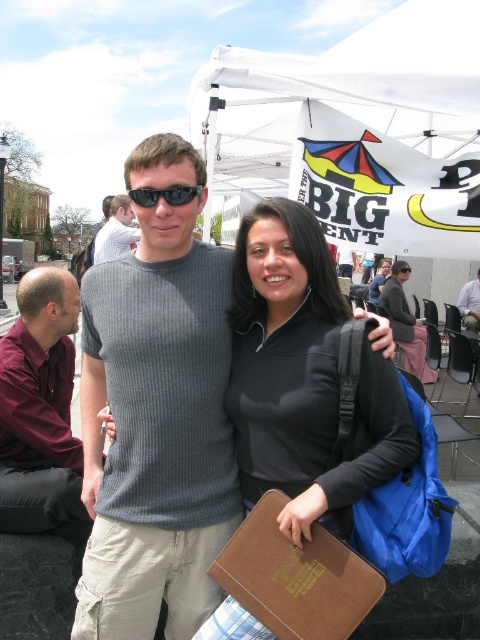
Question: Which of the following is the farthest from the observer?

Choices:
 (A) black matte sunglasses at center
 (B) gray ribbed t-shirt at center
 (C) light blue shirt at center

Answer: (C)

Question: Estimate the real-world distances between objects in this image. Which object is farther from the black matte jacket at center?

Choices:
 (A) light blue shirt at center
 (B) black matte sunglasses at center
 (C) maroon shirt at left
 (D) gray ribbed t-shirt at center

Answer: (A)

Question: Can you confirm if gray ribbed t-shirt at center is positioned to the left of light blue shirt at center?

Choices:
 (A) no
 (B) yes

Answer: (B)

Question: Estimate the real-world distances between objects in this image. Which object is closer to the black matte sunglasses at center?

Choices:
 (A) black matte jacket at center
 (B) white shirt at left

Answer: (A)

Question: Does maroon shirt at left have a smaller size compared to light blue shirt at center?

Choices:
 (A) no
 (B) yes

Answer: (A)

Question: Can you confirm if maroon shirt at left is positioned to the left of light blue shirt at center?

Choices:
 (A) no
 (B) yes

Answer: (B)